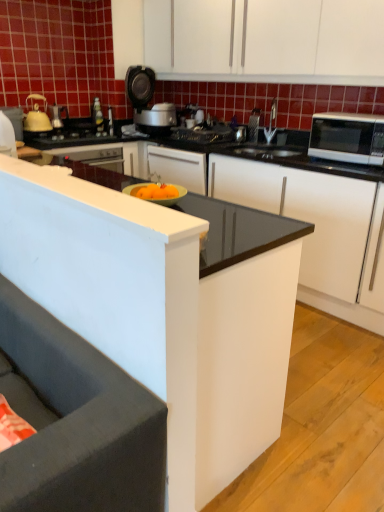
Question: Is white glossy microwave at right positioned with its back to metallic silver toaster at upper center?

Choices:
 (A) yes
 (B) no

Answer: (B)

Question: Is the depth of white glossy microwave at right greater than that of metallic silver toaster at upper center?

Choices:
 (A) yes
 (B) no

Answer: (B)

Question: From a real-world perspective, is white glossy microwave at right located beneath metallic silver toaster at upper center?

Choices:
 (A) no
 (B) yes

Answer: (A)

Question: Could you tell me if white glossy microwave at right is facing metallic silver toaster at upper center?

Choices:
 (A) yes
 (B) no

Answer: (B)

Question: Does white glossy microwave at right appear on the right side of metallic silver toaster at upper center?

Choices:
 (A) no
 (B) yes

Answer: (B)

Question: Is white glossy microwave at right shorter than metallic silver toaster at upper center?

Choices:
 (A) yes
 (B) no

Answer: (B)

Question: Is white glossy microwave at right to the right of matte yellow tea pot at left from the viewer's perspective?

Choices:
 (A) no
 (B) yes

Answer: (B)

Question: Is white glossy microwave at right far away from matte yellow tea pot at left?

Choices:
 (A) no
 (B) yes

Answer: (B)

Question: Can you confirm if white glossy microwave at right is smaller than matte yellow tea pot at left?

Choices:
 (A) no
 (B) yes

Answer: (A)

Question: Can we say white glossy microwave at right lies outside matte yellow tea pot at left?

Choices:
 (A) yes
 (B) no

Answer: (A)

Question: From the image's perspective, is white glossy microwave at right over matte yellow tea pot at left?

Choices:
 (A) no
 (B) yes

Answer: (A)

Question: Considering the relative sizes of white glossy microwave at right and matte yellow tea pot at left in the image provided, is white glossy microwave at right bigger than matte yellow tea pot at left?

Choices:
 (A) no
 (B) yes

Answer: (B)

Question: Is white matte cabinet at upper center, acting as the 1th cabinetry starting from the top, outside of white glossy cabinet at center, the 2th cabinetry in the top-to-bottom sequence?

Choices:
 (A) yes
 (B) no

Answer: (A)